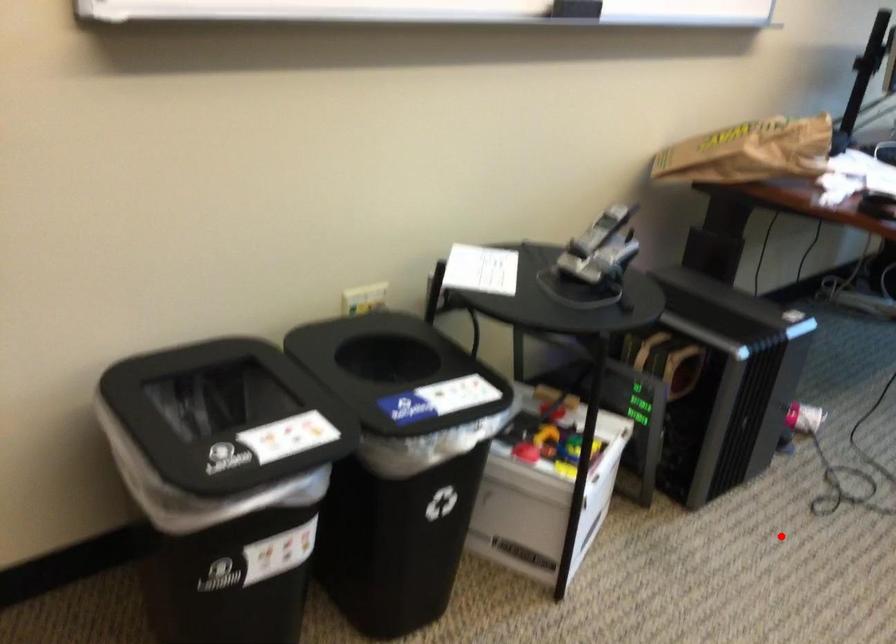
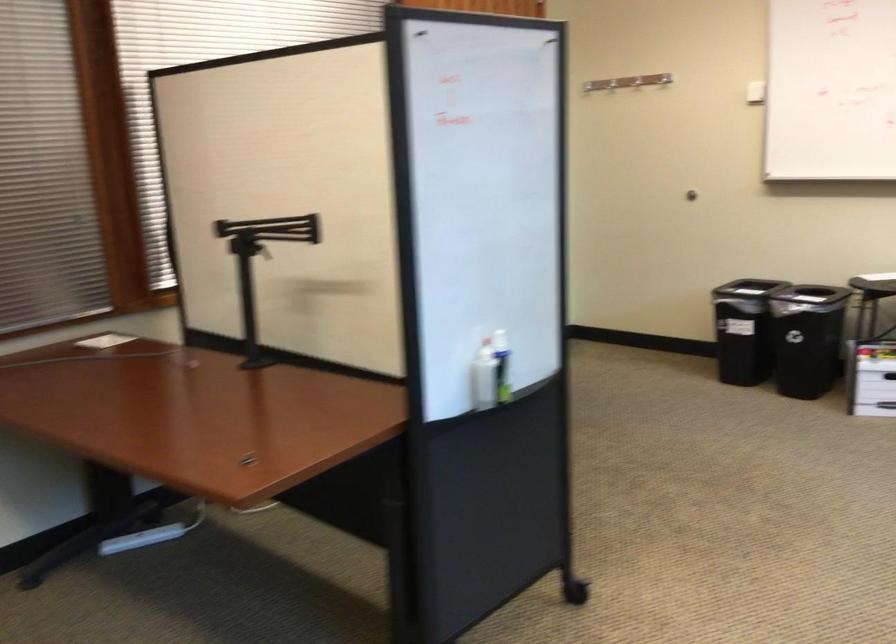
Question: I am providing you with two images of the same scene from different viewpoints. A red point is shown in image1. For the corresponding object point in image2, is it positioned nearer or farther from the camera?

Choices:
 (A) Nearer
 (B) Farther

Answer: (B)